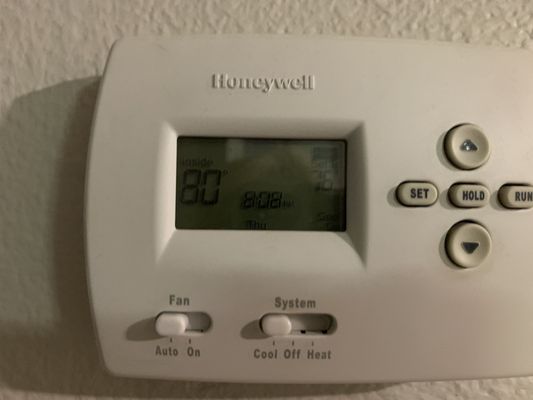
Where is `fan slide button`? The height and width of the screenshot is (400, 533). fan slide button is located at coordinates (167, 328).